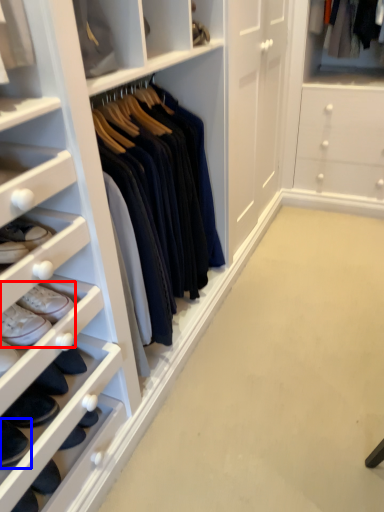
Question: Which object appears closest to the camera in this image, footwear (highlighted by a red box) or footwear (highlighted by a blue box)?

Choices:
 (A) footwear
 (B) footwear

Answer: (B)